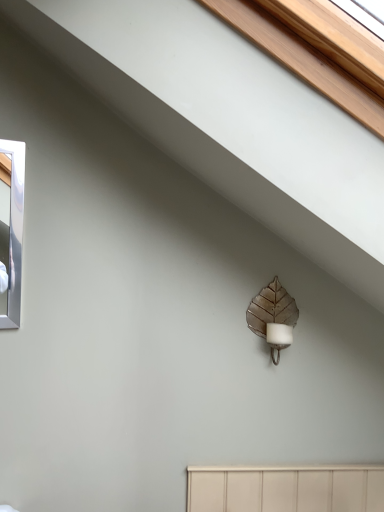
Describe the element at coordinates (273, 316) in the screenshot. The width and height of the screenshot is (384, 512). I see `metallic leaf-shaped candle holder at upper right` at that location.

The width and height of the screenshot is (384, 512). I want to click on metallic leaf-shaped candle holder at upper right, so [x=273, y=316].

I want to click on metallic leaf-shaped candle holder at upper right, so click(x=273, y=316).